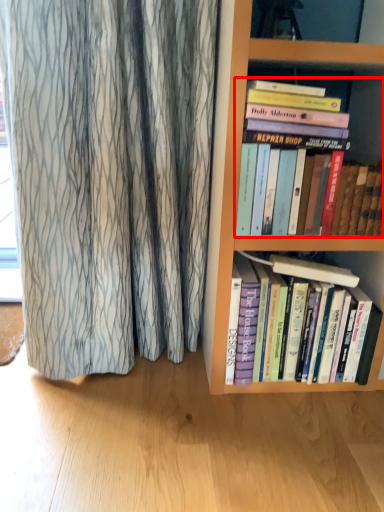
Question: In this image, where is book (annotated by the red box) located relative to book?

Choices:
 (A) right
 (B) left

Answer: (A)